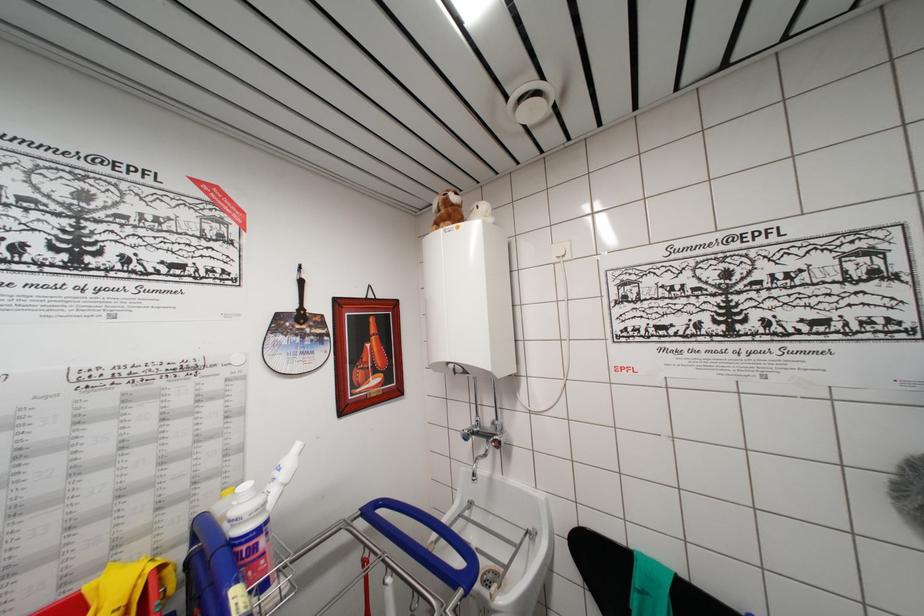
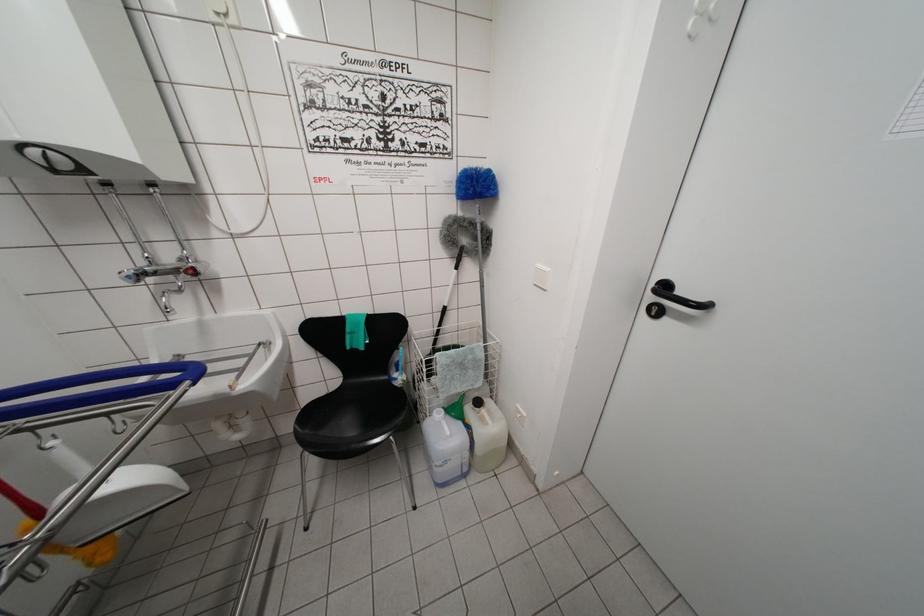
Locate, in the second image, the point that corresponds to (x=468, y=440) in the first image.

(131, 282)